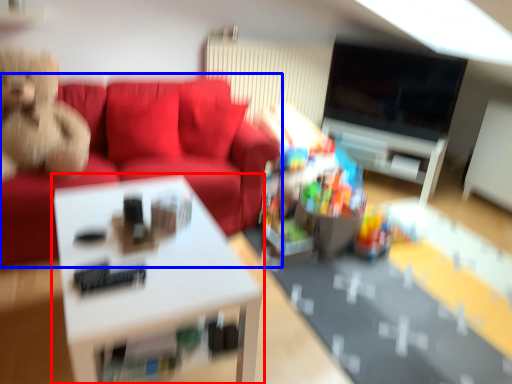
Question: Which point is further to the camera, table (highlighted by a red box) or studio couch (highlighted by a blue box)?

Choices:
 (A) table
 (B) studio couch

Answer: (B)